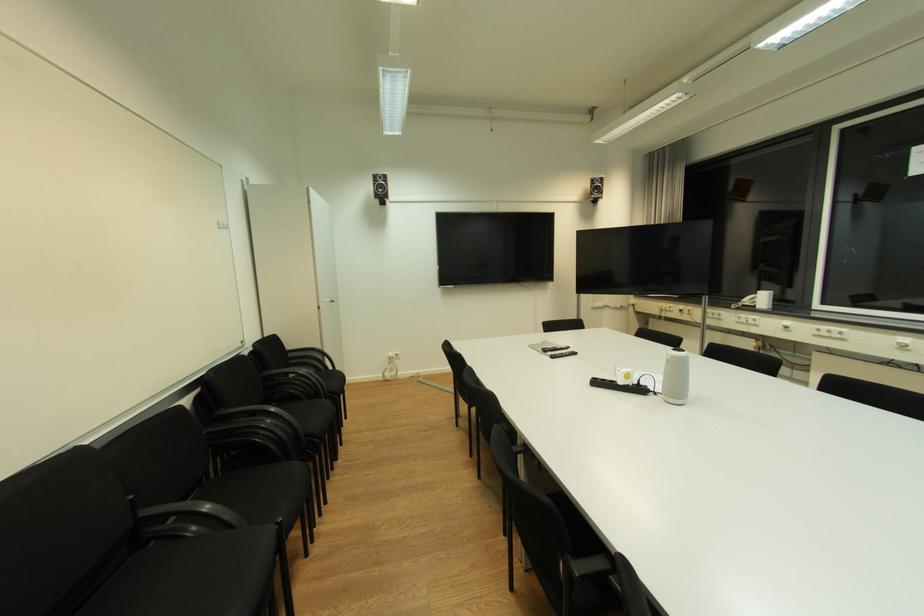
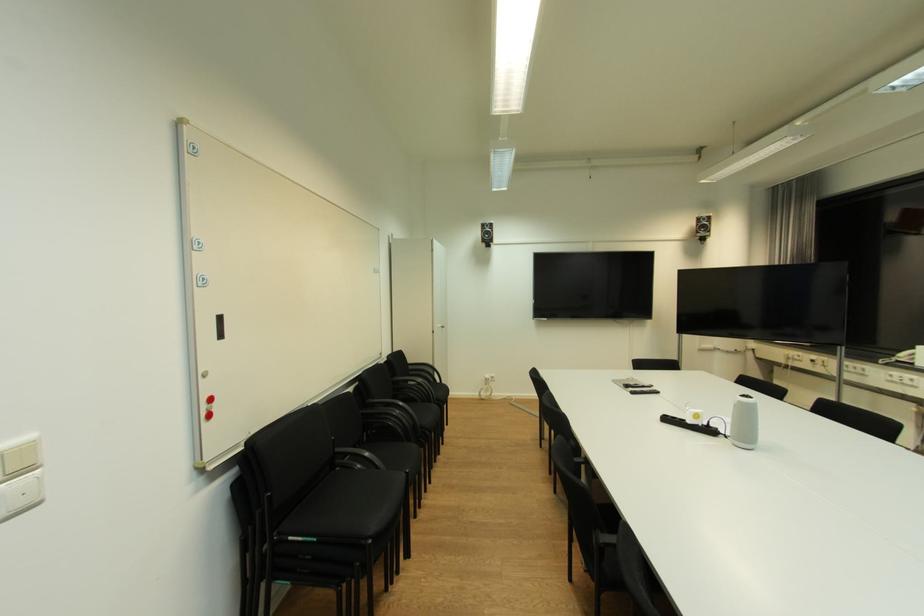
Question: What movement of the cameraman would produce the second image?

Choices:
 (A) Left
 (B) Right
 (C) Forward
 (D) Backward

Answer: (D)